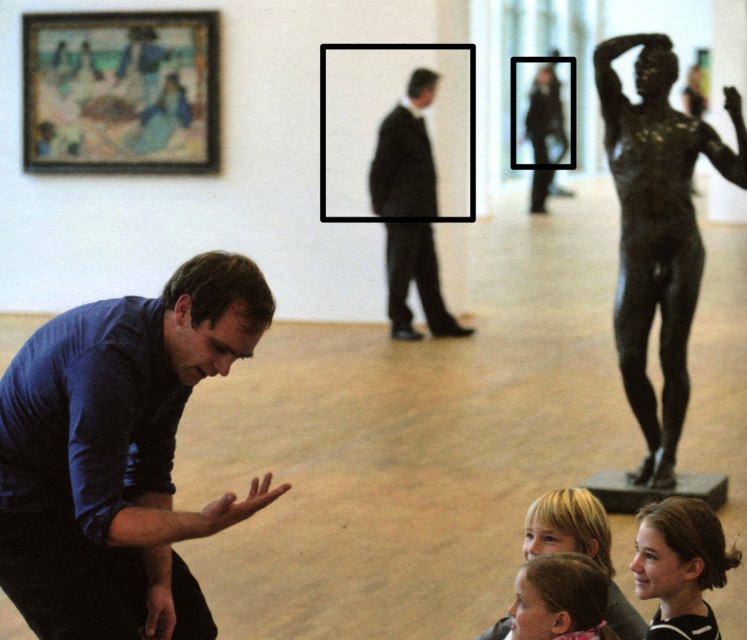
Question: Does bronze statue at right appear over brown hair at lower right?

Choices:
 (A) yes
 (B) no

Answer: (A)

Question: Observing the image, what is the correct spatial positioning of blue matte shirt at lower left in reference to blonde hair at lower center?

Choices:
 (A) below
 (B) above

Answer: (B)

Question: Which point is closer to the camera taking this photo?

Choices:
 (A) (697, 563)
 (B) (149, 577)
 (C) (638, 122)
 (D) (375, 186)

Answer: (B)

Question: Is blue matte shirt at lower left below brown hair at lower right?

Choices:
 (A) no
 (B) yes

Answer: (A)

Question: Considering the real-world distances, which object is farthest from the bronze statue at right?

Choices:
 (A) black suit at center
 (B) blue matte shirt at lower left

Answer: (A)

Question: Which point appears farthest from the camera in this image?

Choices:
 (A) (75, 364)
 (B) (657, 269)

Answer: (B)